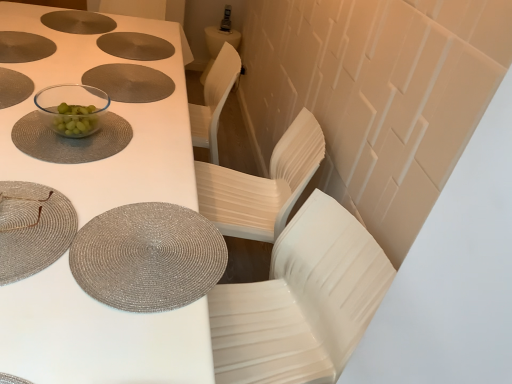
Where is `vacant area to the right of silver woven placemat at lower left, which is the first tableware in front-to-back order`? vacant area to the right of silver woven placemat at lower left, which is the first tableware in front-to-back order is located at coordinates (124, 254).